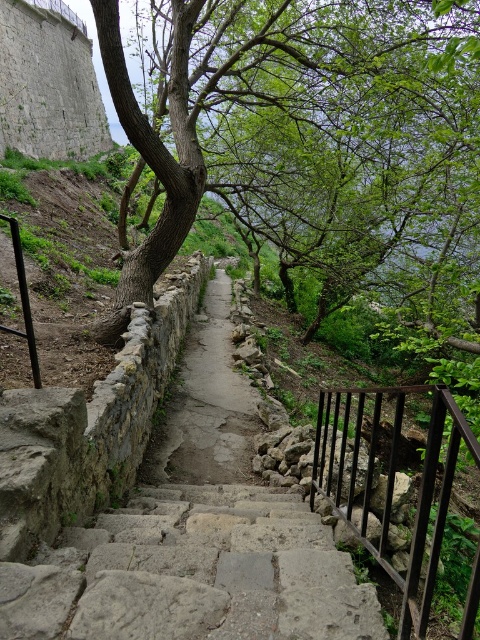
Question: Is black metal railing at right to the left of dull stone path at center from the viewer's perspective?

Choices:
 (A) yes
 (B) no

Answer: (B)

Question: Can you confirm if black metal railing at right is positioned to the left of dull stone path at center?

Choices:
 (A) yes
 (B) no

Answer: (B)

Question: Does smooth brown tree trunk at center have a smaller size compared to gray stone stairs at center?

Choices:
 (A) yes
 (B) no

Answer: (B)

Question: Which point is closer to the camera?

Choices:
 (A) (242, 166)
 (B) (189, 442)
 (C) (384, 540)
 (D) (216, 620)

Answer: (D)

Question: Among these objects, which one is farthest from the camera?

Choices:
 (A) gray stone stairs at center
 (B) smooth brown tree trunk at center

Answer: (B)

Question: Estimate the real-world distances between objects in this image. Which object is closer to the gray stone stairs at center?

Choices:
 (A) black metal railing at right
 (B) smooth brown tree trunk at center

Answer: (A)